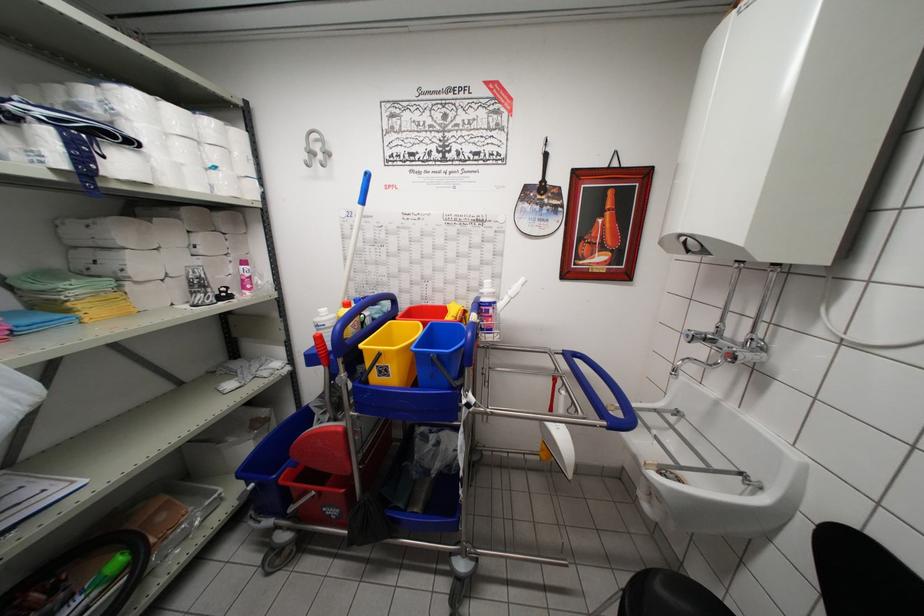
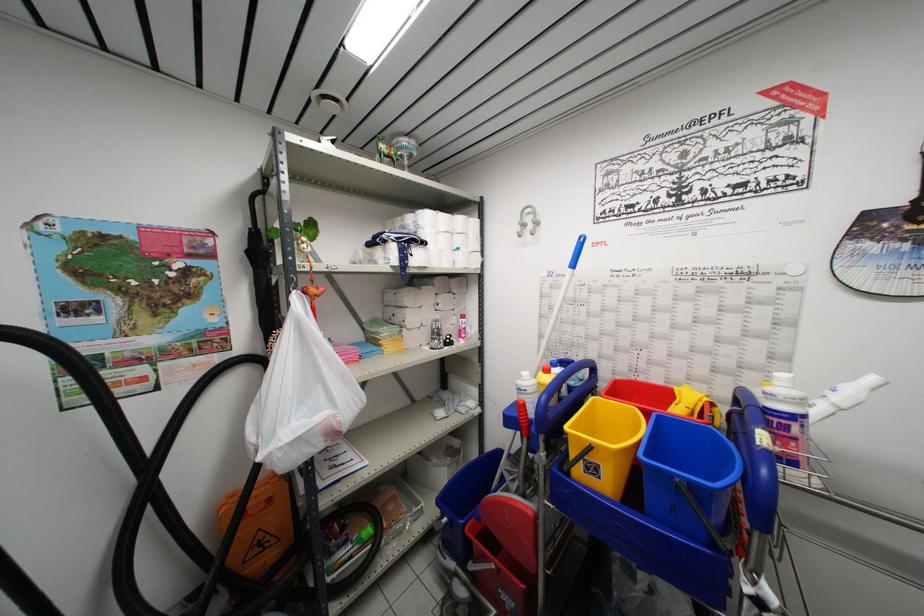
Locate, in the second image, the point that corresponds to point 432,358 in the first image.

(675, 479)